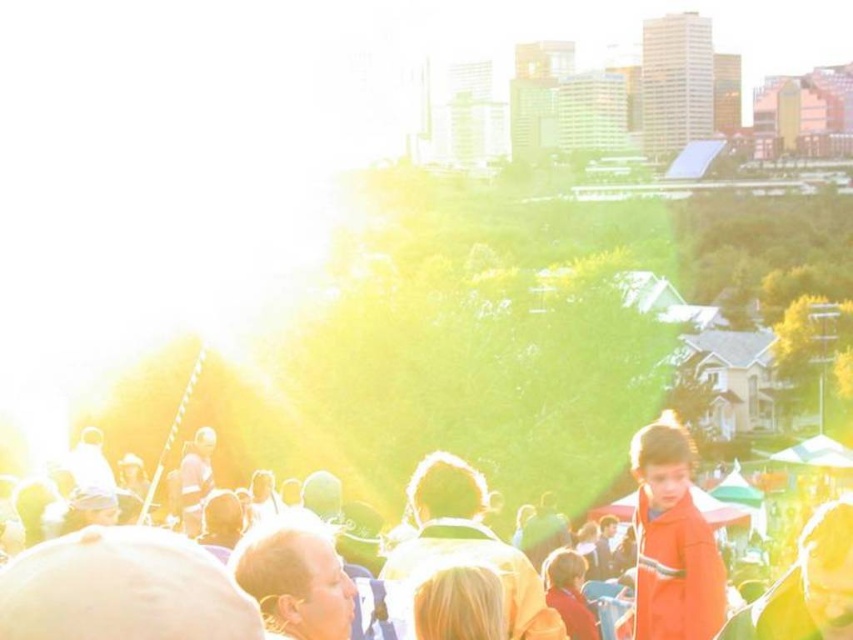
Question: Is orange fabric at center smaller than orange matte coat at lower right?

Choices:
 (A) yes
 (B) no

Answer: (B)

Question: Which of the following is the farthest from the observer?

Choices:
 (A) (830, 504)
 (B) (631, 630)

Answer: (B)

Question: Does orange fabric at center appear on the right side of orange matte coat at lower right?

Choices:
 (A) yes
 (B) no

Answer: (B)

Question: Is orange fabric at center further to camera compared to orange matte coat at lower right?

Choices:
 (A) yes
 (B) no

Answer: (B)

Question: Among these objects, which one is nearest to the camera?

Choices:
 (A) orange matte coat at lower right
 (B) orange fabric at center

Answer: (B)